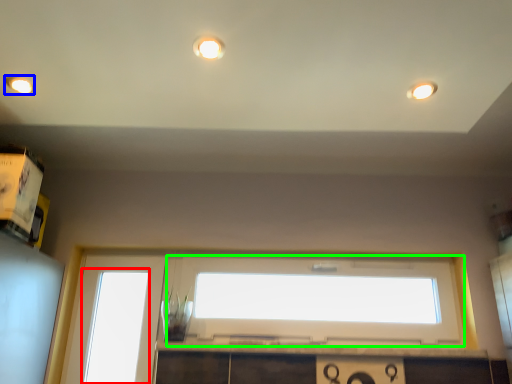
Question: Which is nearer to the window (highlighted by a red box)? lighting (highlighted by a blue box) or window (highlighted by a green box).

Choices:
 (A) lighting
 (B) window

Answer: (B)